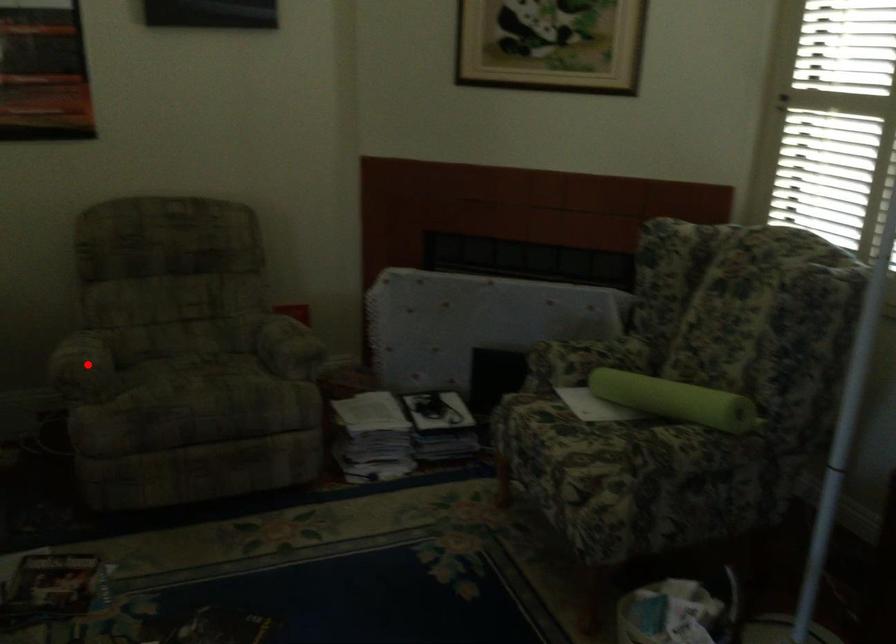
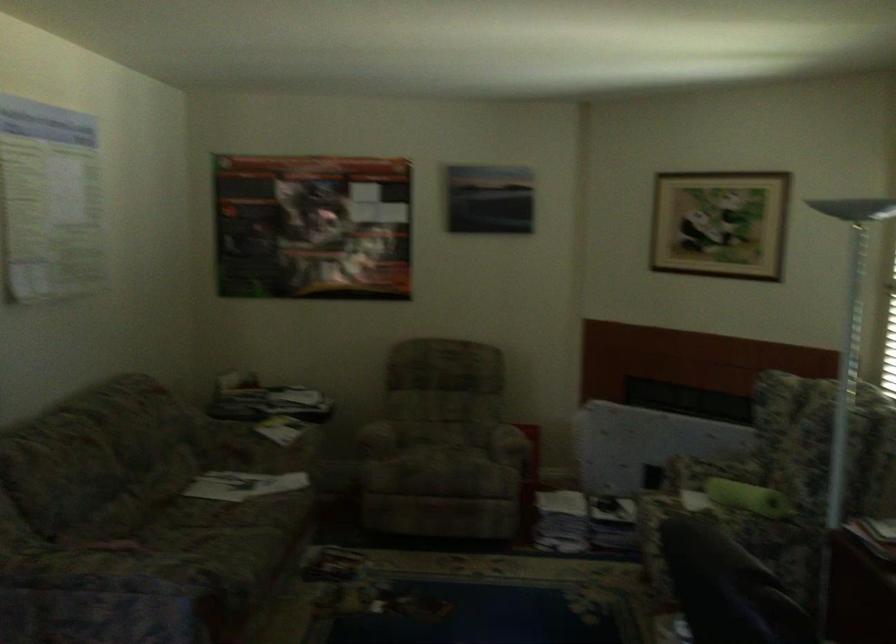
Locate, in the second image, the point that corresponds to the highlighted location in the first image.

(377, 438)